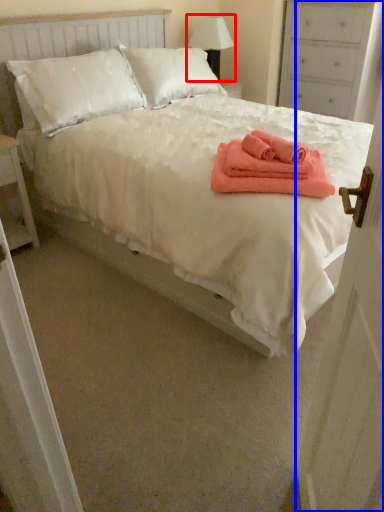
Question: Which object appears closest to the camera in this image, table lamp (highlighted by a red box) or door (highlighted by a blue box)?

Choices:
 (A) table lamp
 (B) door

Answer: (B)